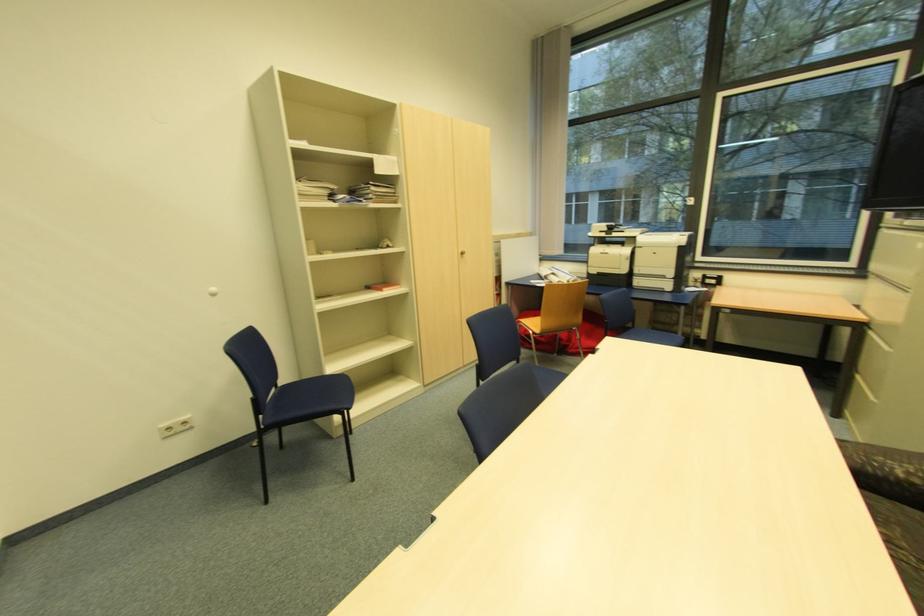
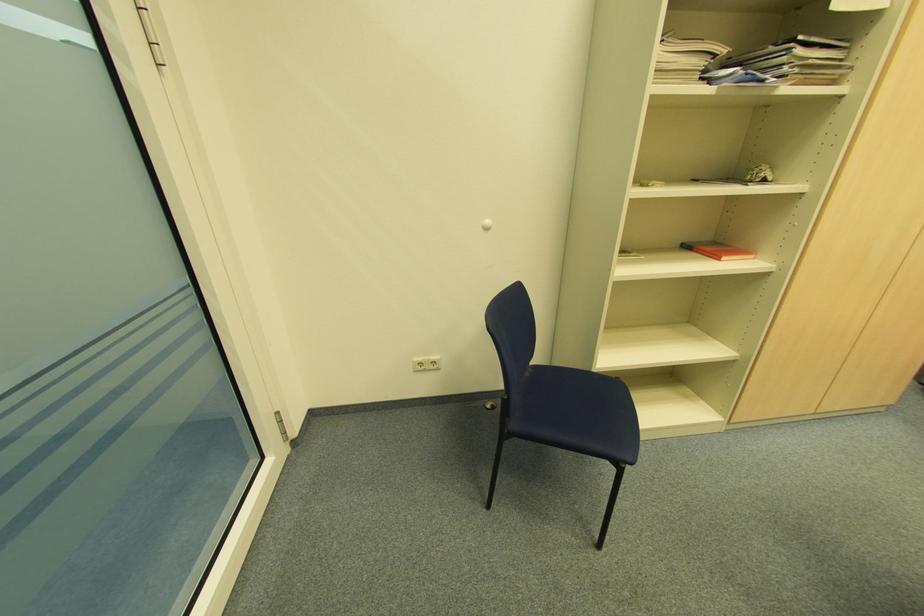
The point at (386, 290) is marked in the first image. Where is the corresponding point in the second image?

(726, 257)